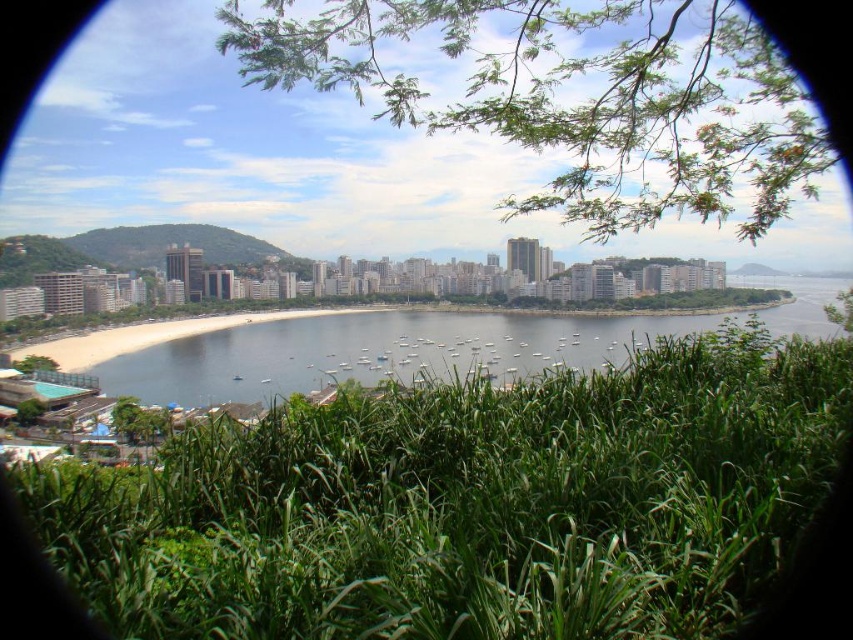
In the scene shown: Is the position of green leafy grass at lower center less distant than that of clear blue water at center?

Yes, it is.

Who is positioned more to the left, green leafy grass at lower center or clear blue water at center?

Positioned to the left is green leafy grass at lower center.

Where is `green leafy grass at lower center`? Image resolution: width=853 pixels, height=640 pixels. green leafy grass at lower center is located at coordinates click(x=476, y=506).